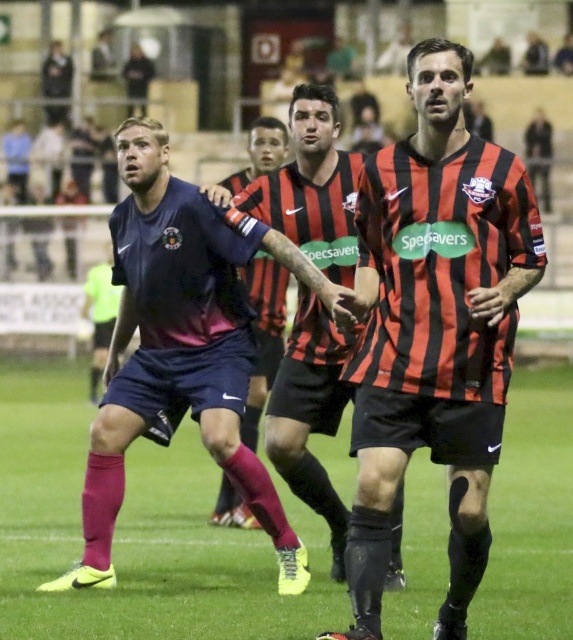
Is red and black striped jersey at center positioned at the back of matte black shorts at center?

No, red and black striped jersey at center is closer to the viewer.

Can you confirm if red and black striped jersey at center is positioned below matte black shorts at center?

No.

Does point (478, 433) come closer to viewer compared to point (257, 392)?

Yes, point (478, 433) is in front of point (257, 392).

You are a GUI agent. You are given a task and a screenshot of the screen. Output one action in this format:
    pyautogui.click(x=<x>, y=<y>)
    Task: Click on the red and black striped jersey at center
    The height and width of the screenshot is (640, 573).
    Given the screenshot: What is the action you would take?
    pyautogui.click(x=434, y=326)

Which of these two, red and black striped jersey at center or dark blue jersey at left, stands shorter?

dark blue jersey at left

This screenshot has width=573, height=640. I want to click on red and black striped jersey at center, so click(x=434, y=326).

At what (x,y) coordinates should I click in order to perform the action: click on red and black striped jersey at center. Please return your answer as a coordinate pair (x, y). The height and width of the screenshot is (640, 573). Looking at the image, I should click on (434, 326).

Does dark blue jersey at left lie behind matte black shorts at center?

No, it is in front of matte black shorts at center.

Can you confirm if dark blue jersey at left is positioned above matte black shorts at center?

Indeed, dark blue jersey at left is positioned over matte black shorts at center.

Find the location of a particular element. The image size is (573, 640). dark blue jersey at left is located at coordinates (175, 349).